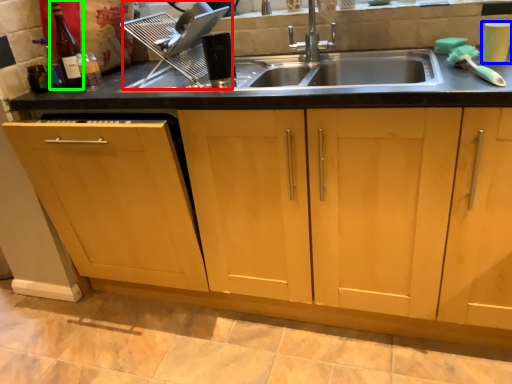
Question: Which object is positioned closest to appliance (highlighted by a red box)? Select from appliance (highlighted by a blue box) and bottle (highlighted by a green box).

Choices:
 (A) appliance
 (B) bottle

Answer: (B)